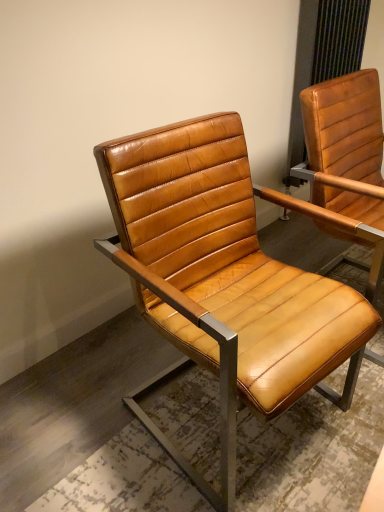
Question: Considering the relative sizes of matte leather chair at right, placed as the second chair when sorted from left to right, and cognac leather chair at center, which ranks as the first chair in left-to-right order, in the image provided, is matte leather chair at right, placed as the second chair when sorted from left to right, taller than cognac leather chair at center, which ranks as the first chair in left-to-right order,?

Choices:
 (A) yes
 (B) no

Answer: (A)

Question: Is matte leather chair at right, placed as the second chair when sorted from left to right, closer to camera compared to cognac leather chair at center, which ranks as the first chair in left-to-right order?

Choices:
 (A) no
 (B) yes

Answer: (A)

Question: Does matte leather chair at right, which is the 1th chair in right-to-left order, turn towards cognac leather chair at center, which ranks as the first chair in left-to-right order?

Choices:
 (A) no
 (B) yes

Answer: (A)

Question: Is matte leather chair at right, placed as the second chair when sorted from left to right, at the right side of cognac leather chair at center, positioned as the 2th chair in right-to-left order?

Choices:
 (A) no
 (B) yes

Answer: (B)

Question: Is matte leather chair at right, which is the 1th chair in right-to-left order, thinner than cognac leather chair at center, which ranks as the first chair in left-to-right order?

Choices:
 (A) yes
 (B) no

Answer: (A)

Question: Considering the relative sizes of matte leather chair at right, which is the 1th chair in right-to-left order, and cognac leather chair at center, which ranks as the first chair in left-to-right order, in the image provided, is matte leather chair at right, which is the 1th chair in right-to-left order, smaller than cognac leather chair at center, which ranks as the first chair in left-to-right order,?

Choices:
 (A) yes
 (B) no

Answer: (A)

Question: Can you confirm if cognac leather chair at center, which ranks as the first chair in left-to-right order, is taller than matte leather chair at right, which is the 1th chair in right-to-left order?

Choices:
 (A) yes
 (B) no

Answer: (B)

Question: Would you say matte leather chair at right, which is the 1th chair in right-to-left order, is part of cognac leather chair at center, which ranks as the first chair in left-to-right order,'s contents?

Choices:
 (A) no
 (B) yes

Answer: (A)

Question: Is cognac leather chair at center, which ranks as the first chair in left-to-right order, not inside matte leather chair at right, which is the 1th chair in right-to-left order?

Choices:
 (A) no
 (B) yes

Answer: (B)

Question: Can you confirm if cognac leather chair at center, positioned as the 2th chair in right-to-left order, is wider than matte leather chair at right, placed as the second chair when sorted from left to right?

Choices:
 (A) yes
 (B) no

Answer: (A)

Question: Can you confirm if cognac leather chair at center, which ranks as the first chair in left-to-right order, is bigger than matte leather chair at right, placed as the second chair when sorted from left to right?

Choices:
 (A) yes
 (B) no

Answer: (A)

Question: From a real-world perspective, is cognac leather chair at center, positioned as the 2th chair in right-to-left order, physically above matte leather chair at right, placed as the second chair when sorted from left to right?

Choices:
 (A) no
 (B) yes

Answer: (A)

Question: Is matte leather chair at right, placed as the second chair when sorted from left to right, inside or outside of cognac leather chair at center, positioned as the 2th chair in right-to-left order?

Choices:
 (A) inside
 (B) outside

Answer: (B)